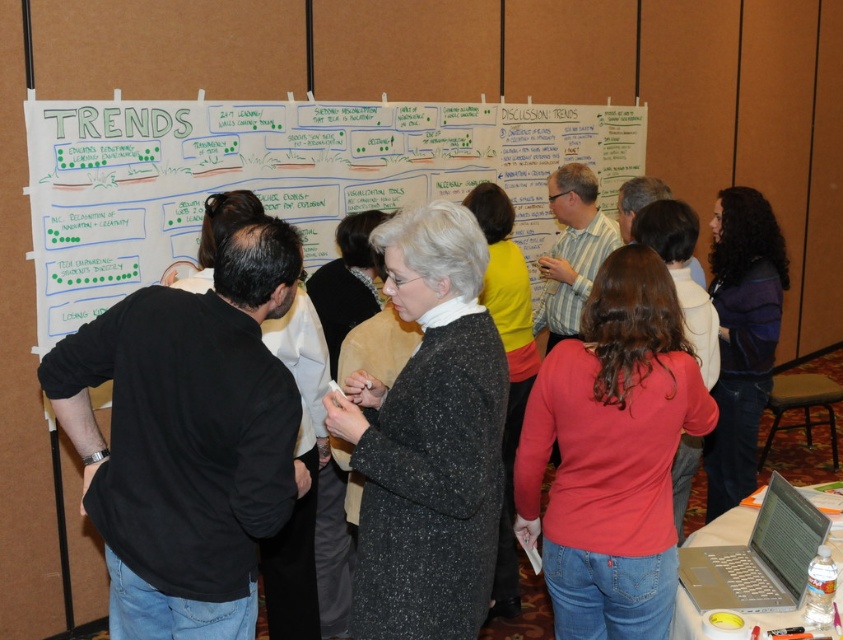
Which is below, dark blue sweater at right or silver metallic laptop at lower right?

silver metallic laptop at lower right is below.

Image resolution: width=843 pixels, height=640 pixels. In order to click on dark blue sweater at right in this screenshot , I will do `click(742, 337)`.

Identify the location of dark blue sweater at right. (742, 337).

Based on the photo, is speckled wool coat at center smaller than dark blue sweater at right?

Correct, speckled wool coat at center occupies less space than dark blue sweater at right.

The image size is (843, 640). In order to click on speckled wool coat at center in this screenshot , I will do `click(428, 438)`.

I want to click on speckled wool coat at center, so click(x=428, y=438).

Where is `white paperboard at center`? The height and width of the screenshot is (640, 843). white paperboard at center is located at coordinates (280, 177).

Can you confirm if white paperboard at center is wider than black shirt at left?

Indeed, white paperboard at center has a greater width compared to black shirt at left.

Find the location of a particular element. white paperboard at center is located at coordinates (280, 177).

Where is `white paperboard at center`? Image resolution: width=843 pixels, height=640 pixels. white paperboard at center is located at coordinates (280, 177).